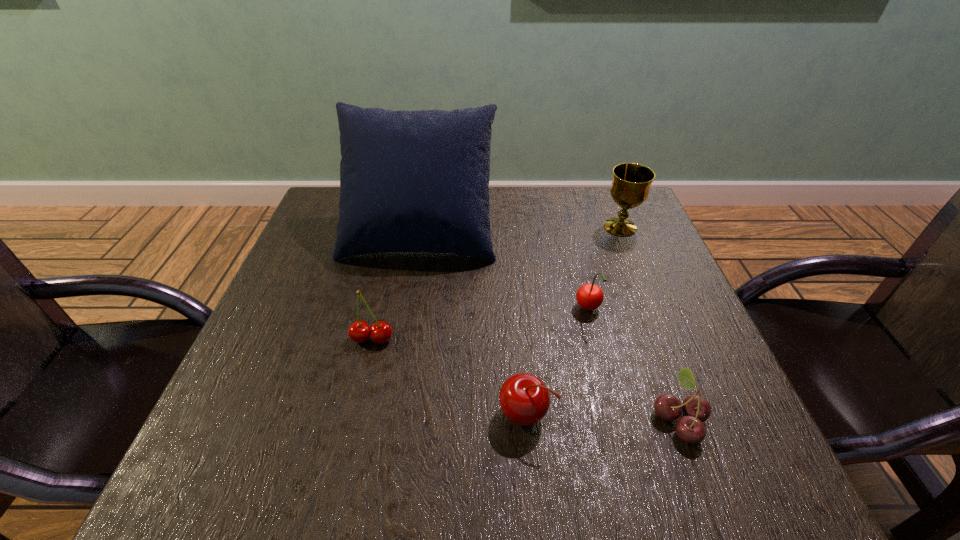
Image resolution: width=960 pixels, height=540 pixels. Find the location of `vacant space located 0.220m on the left of the chalice`. vacant space located 0.220m on the left of the chalice is located at coordinates (517, 227).

The width and height of the screenshot is (960, 540). Identify the location of blank area located 0.310m on the left of the farthest cherry. (428, 309).

The image size is (960, 540). Find the location of `vacant point located with the stems of the fourth farthest object pointing upwards`. vacant point located with the stems of the fourth farthest object pointing upwards is located at coordinates (354, 418).

Find the location of a particular element. The image size is (960, 540). vacant space situated 0.280m on the back of the second cherry from left to right is located at coordinates (515, 285).

You are a GUI agent. You are given a task and a screenshot of the screen. Output one action in this format:
    pyautogui.click(x=<x>, y=<y>)
    Task: Click on the free space located on the leaves of the shortest cherry
    The image size is (960, 540).
    Given the screenshot: What is the action you would take?
    [x=558, y=418]

Find the location of a particular element. vacant space located on the leaves of the shortest cherry is located at coordinates (558, 418).

Image resolution: width=960 pixels, height=540 pixels. In order to click on free space located 0.180m on the leaves of the shortest cherry in this screenshot , I will do `click(546, 418)`.

Where is `cushion that is at the far edge`? This screenshot has height=540, width=960. cushion that is at the far edge is located at coordinates (410, 181).

Locate an element on the screen. chalice at the far edge is located at coordinates (630, 188).

What are the coordinates of `object that is at the left edge` in the screenshot? It's located at (410, 181).